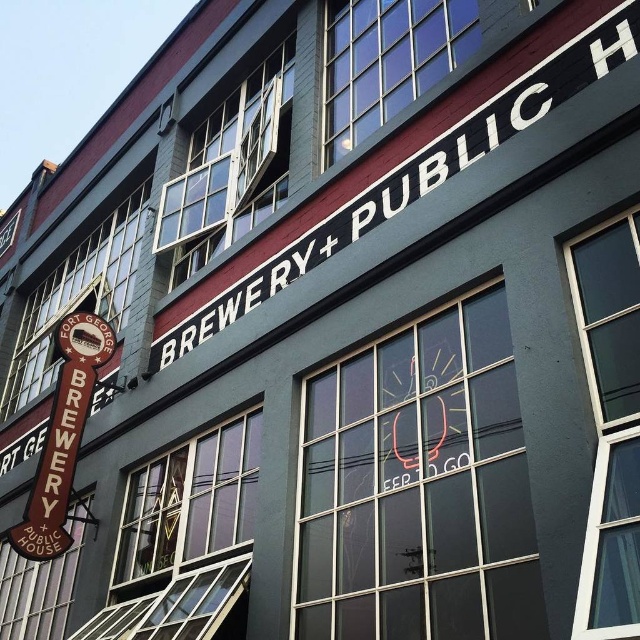
What is the relationship between the sizes of the white painted signboard at center and the brown wooden sign at left?

The white painted signboard at center has a smaller size compared to the brown wooden sign at left.

What is the location of the point with coordinates (419, 173) in the image?

The point with coordinates (419, 173) is located on the white painted signboard at center.